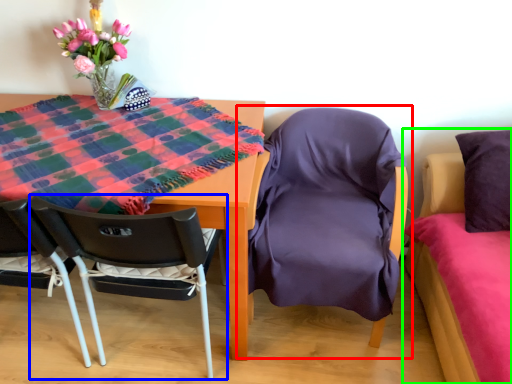
Question: Estimate the real-world distances between objects in this image. Which object is farther from chair (highlighted by a red box), chair (highlighted by a blue box) or bed (highlighted by a green box)?

Choices:
 (A) chair
 (B) bed

Answer: (A)